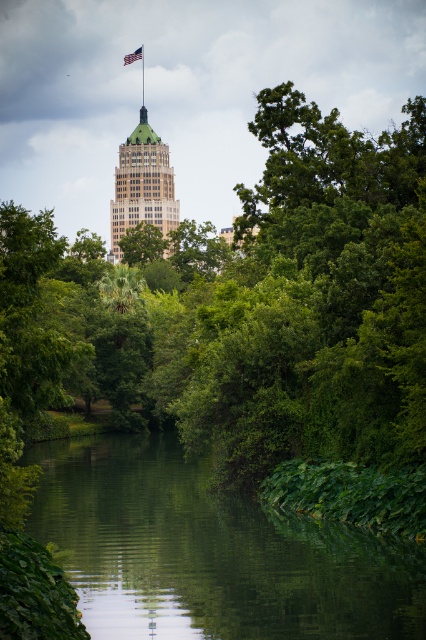
Question: Is green marble skyscraper at center bigger than american flag at upper center?

Choices:
 (A) yes
 (B) no

Answer: (A)

Question: Which of the following is the farthest from the observer?

Choices:
 (A) (422, 378)
 (B) (126, 214)
 (C) (132, 52)

Answer: (C)

Question: Considering the real-world distances, which object is farthest from the green marble skyscraper at center?

Choices:
 (A) metallic pole at upper center
 (B) green leafy river at center

Answer: (B)

Question: Is green leafy tree at center above green marble skyscraper at center?

Choices:
 (A) no
 (B) yes

Answer: (A)

Question: Can you confirm if green leafy river at center is positioned above american flag at upper center?

Choices:
 (A) no
 (B) yes

Answer: (A)

Question: Among these points, which one is farthest from the camera?

Choices:
 (A) (282, 573)
 (B) (143, 83)
 (C) (157, 177)
 (D) (138, 58)

Answer: (B)